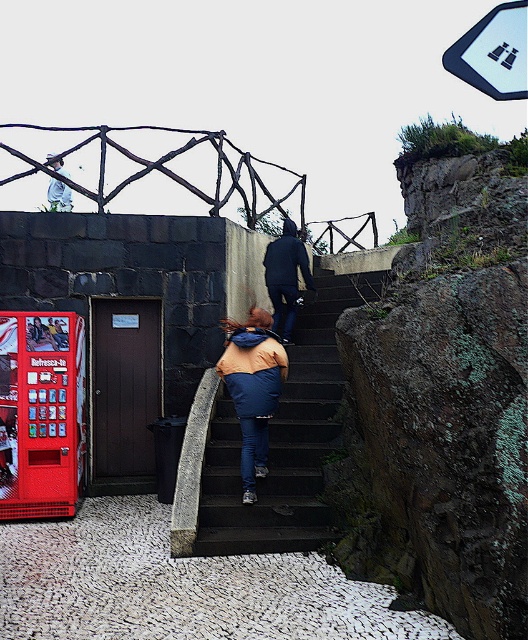
Does red plastic vending machine at lower left lie behind orange fabric jacket at center?

That is True.

Which is in front, point (78, 456) or point (231, 376)?

Positioned in front is point (231, 376).

Locate an element on the screen. red plastic vending machine at lower left is located at coordinates (41, 413).

Which is below, dark gray concrete stairs at center or red plastic vending machine at lower left?

dark gray concrete stairs at center

Who is shorter, dark gray concrete stairs at center or red plastic vending machine at lower left?

dark gray concrete stairs at center is shorter.

At what (x,y) coordinates should I click in order to perform the action: click on dark gray concrete stairs at center. Please return your answer as a coordinate pair (x, y). Looking at the image, I should click on (285, 438).

You are a GUI agent. You are given a task and a screenshot of the screen. Output one action in this format:
    pyautogui.click(x=<x>, y=<y>)
    Task: Click on the dark gray concrete stairs at center
    The image size is (528, 640).
    Given the screenshot: What is the action you would take?
    pyautogui.click(x=285, y=438)

Does orange fabric jacket at center have a larger size compared to dark blue jacket at upper center?

Actually, orange fabric jacket at center might be smaller than dark blue jacket at upper center.

Is point (242, 360) less distant than point (281, 266)?

Yes, it is in front of point (281, 266).

In order to click on orange fabric jacket at center in this screenshot , I will do `click(252, 388)`.